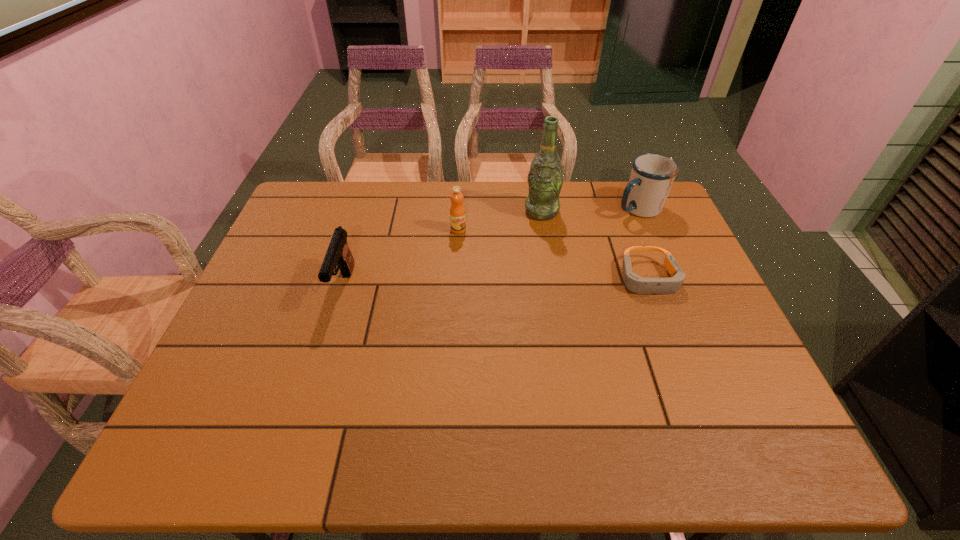
I want to click on vacant space on the desktop that is between the leftmost object and the shortest object and is positioned on the surface of the third object from left to right, so click(x=513, y=282).

Find the location of a particular element. This screenshot has height=540, width=960. vacant space on the desktop that is between the pistol and the goggles and is positioned on the handle side of the mug is located at coordinates (x=526, y=281).

Locate an element on the screen. The image size is (960, 540). free space on the desktop that is between the leftmost object and the goggles and is positioned on the front label of the fourth object from right to left is located at coordinates (461, 284).